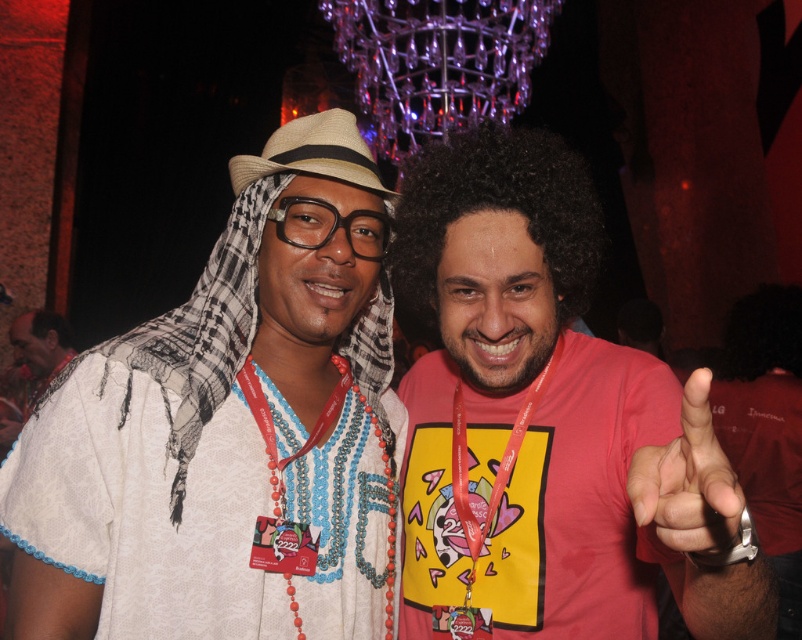
You are at a party and want to take a photo with the pink matte shirt at center and the beige straw cowboy hat at center. Which one is positioned lower in the image?

The pink matte shirt at center is located below the beige straw cowboy hat at center, so it is positioned lower in the image.

You are a photographer at a party and want to take a closeup of the pink matte shirt at center. The camera you are using has a minimum focusing distance of 5 meters. Will you be able to take the closeup?

The pink matte shirt at center is 6.06 meters away from camera, so yes, the photographer can take the closeup since the distance is beyond the minimum focusing distance of 5 meters.